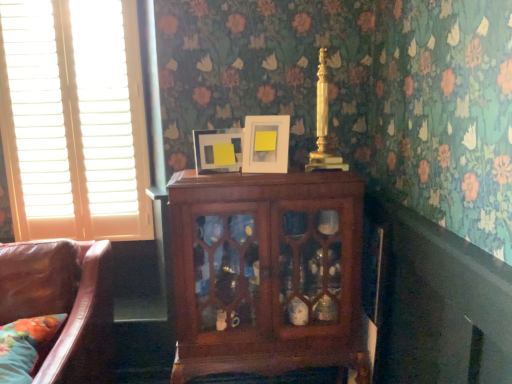
What are the coordinates of `vacant region in front of matte white picture frame at upper center, which is counted as the 1th picture frame, starting from the right` in the screenshot? It's located at (268, 183).